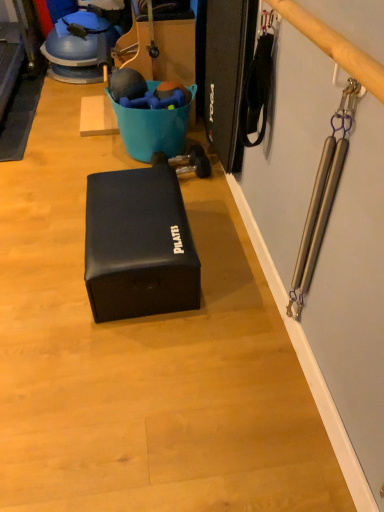
Identify the location of free location to the right of black leather box at center. (231, 264).